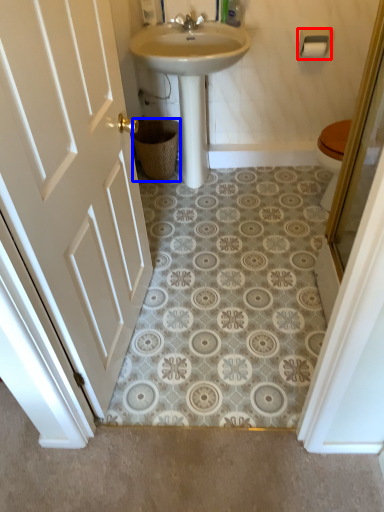
Question: Which point is closer to the camera, towel bar (highlighted by a red box) or basket (highlighted by a blue box)?

Choices:
 (A) towel bar
 (B) basket

Answer: (A)